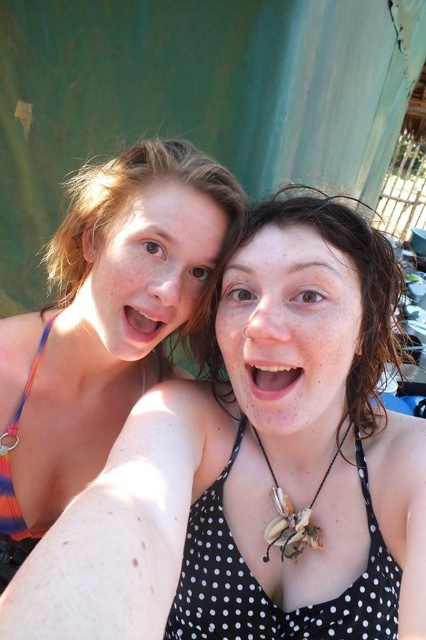
Question: Is matte black bikini top at upper left smaller than multicolored fabric bikini top at left?

Choices:
 (A) no
 (B) yes

Answer: (A)

Question: Does polka dot fabric bikini top at center appear on the right side of multicolored fabric bikini top at left?

Choices:
 (A) yes
 (B) no

Answer: (A)

Question: Considering the real-world distances, which object is farthest from the black polka dot bikini top at center?

Choices:
 (A) polka dot fabric bikini top at center
 (B) multicolored fabric bikini top at left
 (C) matte black bikini top at upper left

Answer: (B)

Question: Which object is the farthest from the matte black bikini top at upper left?

Choices:
 (A) multicolored fabric bikini top at left
 (B) black polka dot bikini top at center

Answer: (A)

Question: Considering the real-world distances, which object is farthest from the black polka dot bikini top at center?

Choices:
 (A) polka dot fabric bikini top at center
 (B) matte black bikini top at upper left

Answer: (A)

Question: Is matte black bikini top at upper left further to camera compared to multicolored fabric bikini top at left?

Choices:
 (A) no
 (B) yes

Answer: (A)